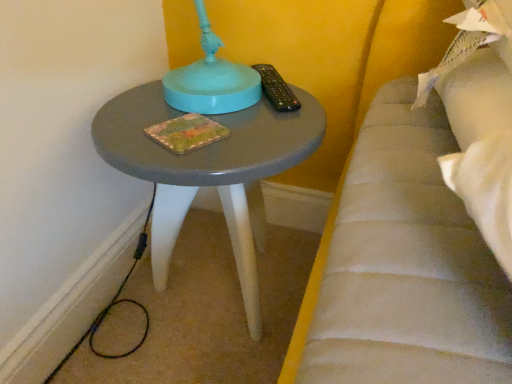
Question: Is matte gray table at center oriented towards black plastic remote at upper right?

Choices:
 (A) no
 (B) yes

Answer: (A)

Question: From the image's perspective, is matte gray table at center above black plastic remote at upper right?

Choices:
 (A) no
 (B) yes

Answer: (A)

Question: Is black plastic remote at upper right a part of matte gray table at center?

Choices:
 (A) no
 (B) yes

Answer: (A)

Question: Is matte gray table at center to the right of black plastic remote at upper right from the viewer's perspective?

Choices:
 (A) yes
 (B) no

Answer: (B)

Question: Does matte gray table at center have a lesser height compared to black plastic remote at upper right?

Choices:
 (A) yes
 (B) no

Answer: (B)

Question: Considering the relative sizes of matte gray table at center and black plastic remote at upper right in the image provided, is matte gray table at center thinner than black plastic remote at upper right?

Choices:
 (A) yes
 (B) no

Answer: (B)

Question: From the image's perspective, is black plastic remote at upper right beneath matte gray table at center?

Choices:
 (A) no
 (B) yes

Answer: (A)

Question: Is black plastic remote at upper right oriented towards matte gray table at center?

Choices:
 (A) no
 (B) yes

Answer: (A)

Question: Can you confirm if black plastic remote at upper right is wider than matte gray table at center?

Choices:
 (A) yes
 (B) no

Answer: (B)

Question: Does black plastic remote at upper right contain matte gray table at center?

Choices:
 (A) yes
 (B) no

Answer: (B)

Question: Considering the relative sizes of black plastic remote at upper right and matte gray table at center in the image provided, is black plastic remote at upper right shorter than matte gray table at center?

Choices:
 (A) yes
 (B) no

Answer: (A)

Question: Does black plastic remote at upper right have a lesser width compared to matte gray table at center?

Choices:
 (A) yes
 (B) no

Answer: (A)

Question: From the image's perspective, is black plastic remote at upper right positioned above or below matte gray table at center?

Choices:
 (A) above
 (B) below

Answer: (A)